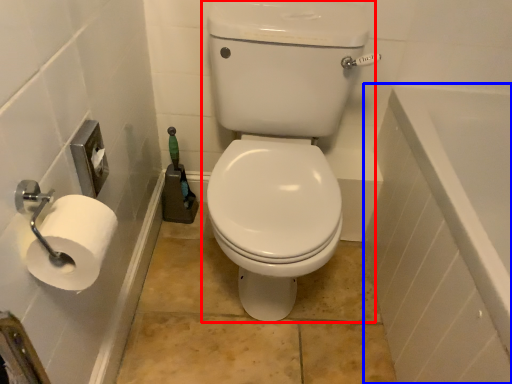
Question: Which object is further to the camera taking this photo, sit (highlighted by a red box) or bath (highlighted by a blue box)?

Choices:
 (A) sit
 (B) bath

Answer: (A)